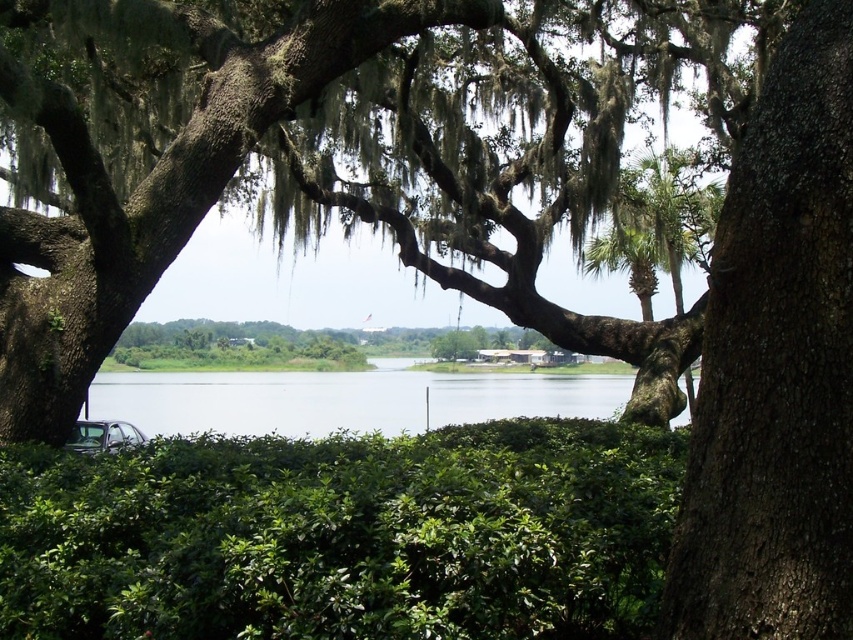
Question: Can you confirm if green leafy hedge at lower center is smaller than clear water at center?

Choices:
 (A) yes
 (B) no

Answer: (A)

Question: Observing the image, what is the correct spatial positioning of green leafy hedge at lower center in reference to clear water at center?

Choices:
 (A) above
 (B) below

Answer: (A)

Question: Which of the following is the farthest from the observer?

Choices:
 (A) (521, 406)
 (B) (312, 460)

Answer: (A)

Question: Considering the relative positions of green leafy hedge at lower center and clear water at center in the image provided, where is green leafy hedge at lower center located with respect to clear water at center?

Choices:
 (A) right
 (B) left

Answer: (A)

Question: Which object appears farthest from the camera in this image?

Choices:
 (A) clear water at center
 (B) green leafy hedge at lower center

Answer: (A)